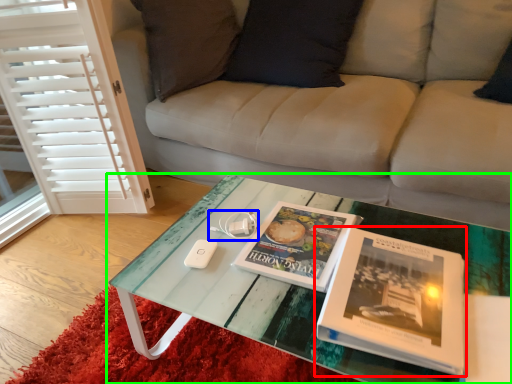
Question: Based on their relative distances, which object is nearer to book (highlighted by a red box)? Choose from game controller (highlighted by a blue box) and coffee table (highlighted by a green box).

Choices:
 (A) game controller
 (B) coffee table

Answer: (B)